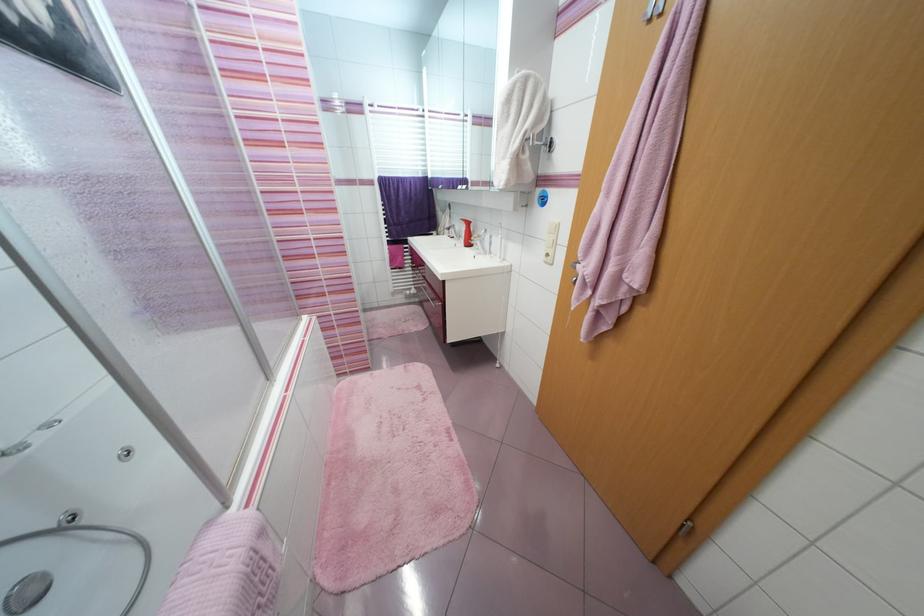
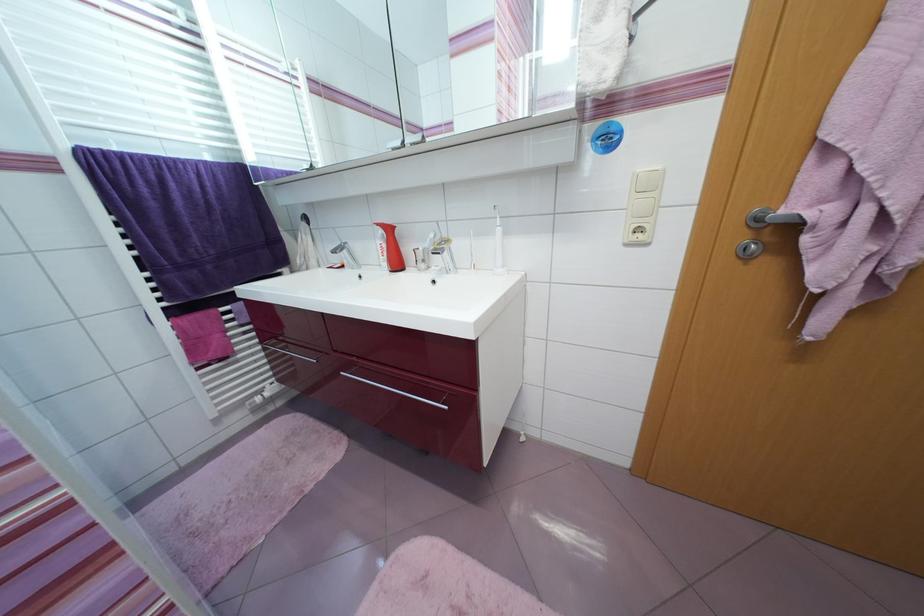
Locate, in the second image, the point that corresponds to [454,230] in the first image.

(338, 254)